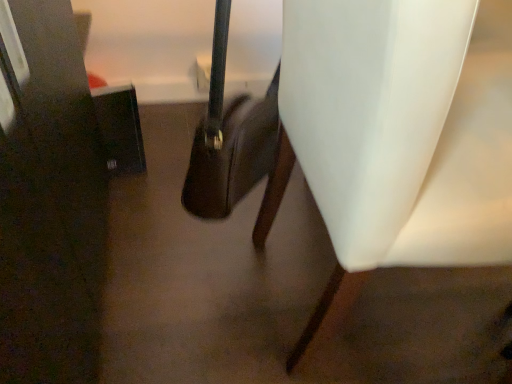
Describe the element at coordinates (392, 142) in the screenshot. The width and height of the screenshot is (512, 384). I see `white matte chair at right` at that location.

In order to face white matte chair at right, should I rotate leftwards or rightwards?

To face it directly, rotate right by 33.673 degrees.

The height and width of the screenshot is (384, 512). What are the coordinates of `white matte chair at right` in the screenshot? It's located at (392, 142).

Measure the distance between white matte chair at right and camera.

white matte chair at right is 11.69 inches away from camera.

Locate an element on the screen. The height and width of the screenshot is (384, 512). white matte chair at right is located at coordinates (392, 142).